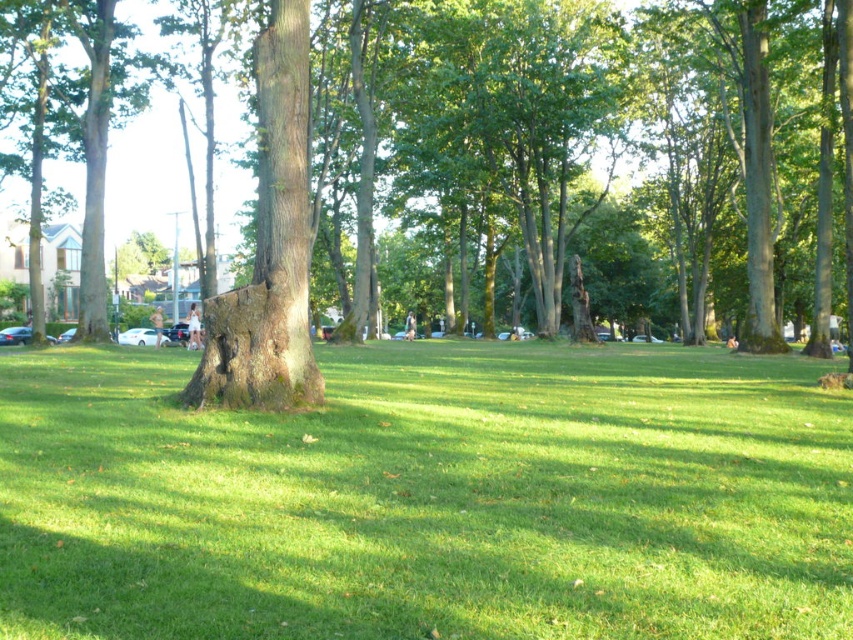
Between rough bark tree at center and smooth brown tree trunk at center, which one appears on the right side from the viewer's perspective?

Positioned to the right is rough bark tree at center.

This screenshot has width=853, height=640. Describe the element at coordinates (553, 168) in the screenshot. I see `rough bark tree at center` at that location.

Describe the element at coordinates (553, 168) in the screenshot. Image resolution: width=853 pixels, height=640 pixels. I see `rough bark tree at center` at that location.

The height and width of the screenshot is (640, 853). Identify the location of rough bark tree at center. (553, 168).

Is green grassy at center above rough bark tree at center?

No.

Can you confirm if green grassy at center is taller than rough bark tree at center?

No, green grassy at center is not taller than rough bark tree at center.

Locate an element on the screen. The width and height of the screenshot is (853, 640). green grassy at center is located at coordinates (428, 497).

Which is in front, point (289, 468) or point (206, 388)?

Point (289, 468) is more forward.

Identify the location of green grassy at center. The image size is (853, 640). (428, 497).

The image size is (853, 640). What are the coordinates of `green grassy at center` in the screenshot? It's located at (428, 497).